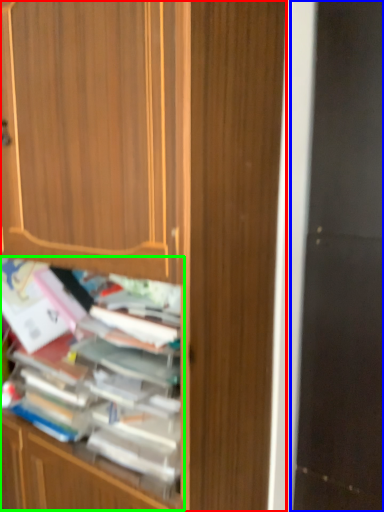
Question: Which object is positioned farthest from cabinetry (highlighted by a red box)? Select from screen door (highlighted by a blue box) and shelf (highlighted by a green box).

Choices:
 (A) screen door
 (B) shelf

Answer: (A)